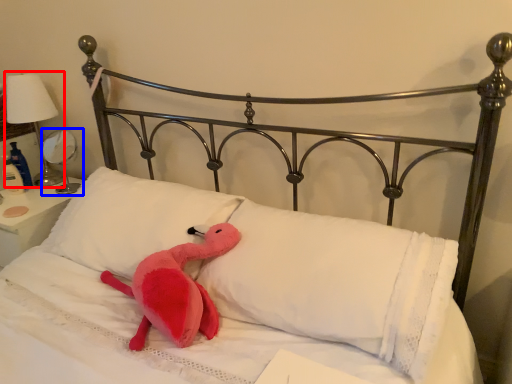
Question: Which of the following is the farthest to the observer, table lamp (highlighted by a red box) or table lamp (highlighted by a blue box)?

Choices:
 (A) table lamp
 (B) table lamp

Answer: (B)